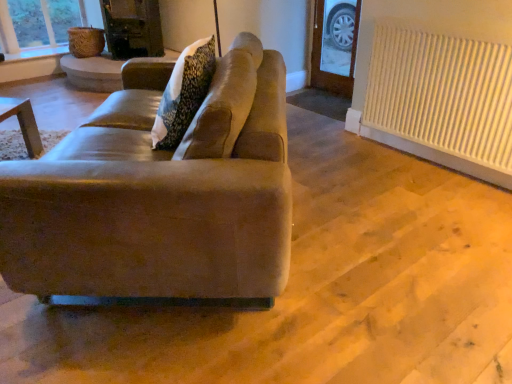
Identify the location of vacant space underneath white ribbed radiator at right (from a real-world perspective). This screenshot has width=512, height=384. click(431, 155).